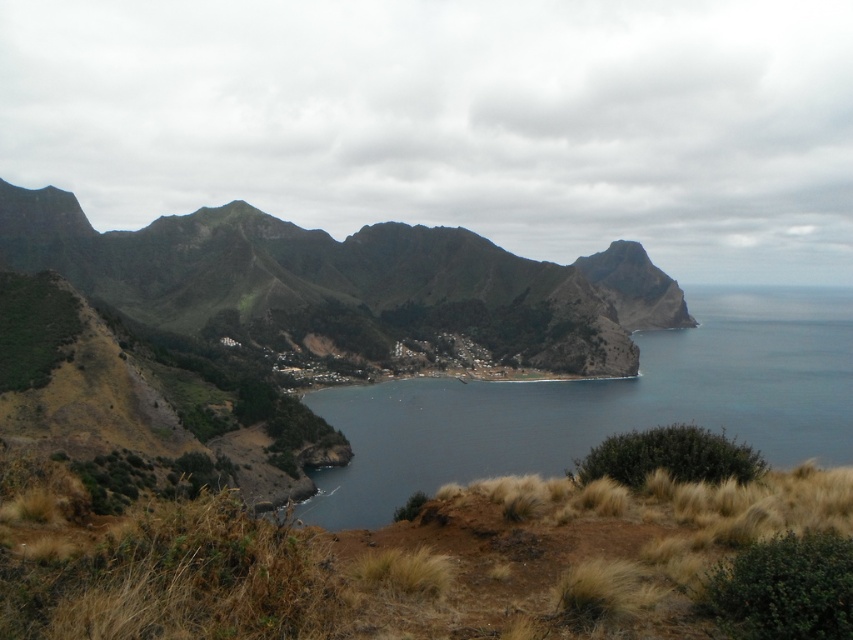
Can you confirm if green rough mountain at center is positioned to the right of dark blue water at center?

Incorrect, green rough mountain at center is not on the right side of dark blue water at center.

Which is in front, point (596, 304) or point (834, 412)?

Point (834, 412) is in front.

Find the location of a particular element. The width and height of the screenshot is (853, 640). green rough mountain at center is located at coordinates (347, 282).